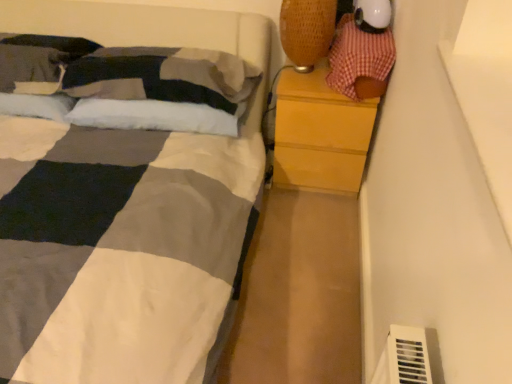
Find the location of a particular element. Image resolution: width=512 pixels, height=384 pixels. free region under woven fabric table lamp at upper right (from a real-world perspective) is located at coordinates (306, 72).